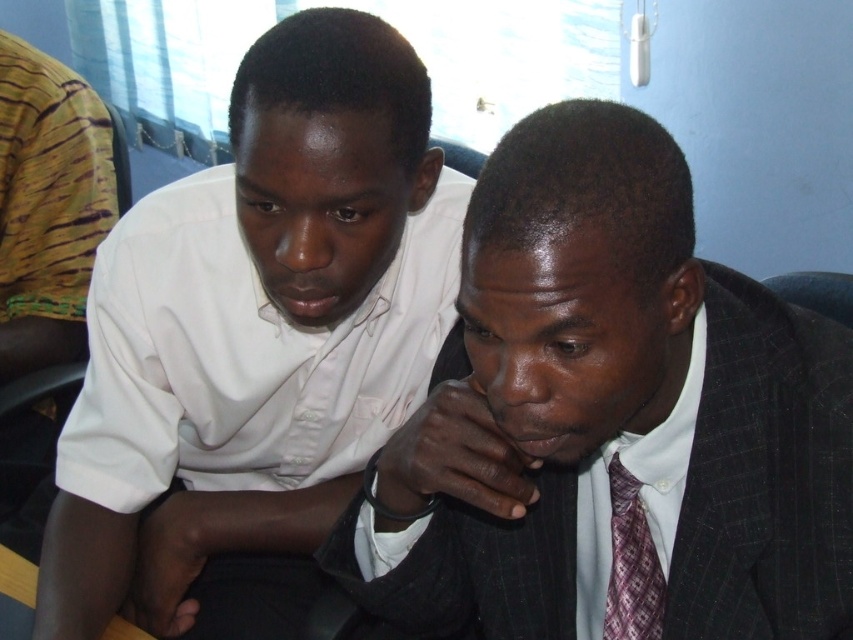
Question: Which of the following is the closest to the observer?

Choices:
 (A) (686, 387)
 (B) (643, 552)
 (C) (431, 365)

Answer: (A)

Question: From the image, what is the correct spatial relationship of dark gray suit at center in relation to plaid silk tie at center?

Choices:
 (A) right
 (B) left

Answer: (B)

Question: Does white shirt at left appear on the right side of plaid silk tie at center?

Choices:
 (A) no
 (B) yes

Answer: (A)

Question: Among these objects, which one is nearest to the camera?

Choices:
 (A) plaid silk tie at center
 (B) dark gray suit at center

Answer: (B)

Question: Which object appears farthest from the camera in this image?

Choices:
 (A) white shirt at left
 (B) plaid silk tie at center
 (C) dark gray suit at center

Answer: (A)

Question: Is white shirt at left wider than plaid silk tie at center?

Choices:
 (A) yes
 (B) no

Answer: (A)